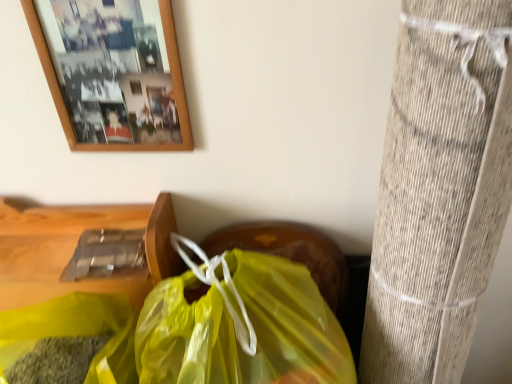
Question: Should I look upward or downward to see wooden picture frame at upper left?

Choices:
 (A) down
 (B) up

Answer: (B)

Question: Considering the relative positions of translucent yellow plastic bag at lower center and wooden picture frame at upper left in the image provided, is translucent yellow plastic bag at lower center in front of wooden picture frame at upper left?

Choices:
 (A) no
 (B) yes

Answer: (B)

Question: From a real-world perspective, is translucent yellow plastic bag at lower center under wooden picture frame at upper left?

Choices:
 (A) no
 (B) yes

Answer: (B)

Question: Is translucent yellow plastic bag at lower center looking in the opposite direction of wooden picture frame at upper left?

Choices:
 (A) no
 (B) yes

Answer: (A)

Question: Does translucent yellow plastic bag at lower center have a larger size compared to wooden picture frame at upper left?

Choices:
 (A) no
 (B) yes

Answer: (B)

Question: Can you confirm if translucent yellow plastic bag at lower center is shorter than wooden picture frame at upper left?

Choices:
 (A) yes
 (B) no

Answer: (B)

Question: Does translucent yellow plastic bag at lower center have a greater height compared to wooden picture frame at upper left?

Choices:
 (A) no
 (B) yes

Answer: (B)

Question: Is wooden picture frame at upper left further to camera compared to translucent yellow plastic bag at lower center?

Choices:
 (A) no
 (B) yes

Answer: (B)

Question: Is wooden picture frame at upper left oriented away from translucent yellow plastic bag at lower center?

Choices:
 (A) no
 (B) yes

Answer: (A)

Question: Is wooden picture frame at upper left not near translucent yellow plastic bag at lower center?

Choices:
 (A) no
 (B) yes

Answer: (A)

Question: Is wooden picture frame at upper left at the right side of translucent yellow plastic bag at lower center?

Choices:
 (A) no
 (B) yes

Answer: (A)

Question: From a real-world perspective, is wooden picture frame at upper left beneath translucent yellow plastic bag at lower center?

Choices:
 (A) no
 (B) yes

Answer: (A)

Question: Can you confirm if wooden picture frame at upper left is wider than translucent yellow plastic bag at lower center?

Choices:
 (A) yes
 (B) no

Answer: (B)

Question: Is point (300, 324) positioned closer to the camera than point (112, 16)?

Choices:
 (A) closer
 (B) farther

Answer: (B)